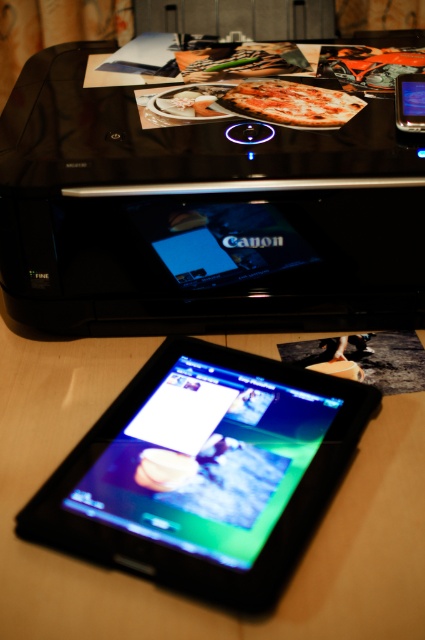
Is black glossy printer at upper center further to the viewer compared to slate gray plastic ipod at upper right?

No, it is not.

Can you confirm if black glossy printer at upper center is positioned above slate gray plastic ipod at upper right?

No, black glossy printer at upper center is not above slate gray plastic ipod at upper right.

Is point (229, 195) closer to camera compared to point (408, 106)?

Yes, it is.

Locate an element on the screen. This screenshot has height=640, width=425. black glossy printer at upper center is located at coordinates (200, 212).

Which is in front, point (125, 228) or point (295, 493)?

Point (295, 493)

Is black glossy printer at upper center bigger than black glossy tablet at center?

Yes.

The height and width of the screenshot is (640, 425). I want to click on black glossy printer at upper center, so click(200, 212).

Identify the location of black glossy printer at upper center. [200, 212].

Who is positioned more to the right, black glossy tablet at center or slate gray plastic ipod at upper right?

slate gray plastic ipod at upper right is more to the right.

Can you confirm if black glossy tablet at center is positioned below slate gray plastic ipod at upper right?

Indeed, black glossy tablet at center is positioned under slate gray plastic ipod at upper right.

Between point (85, 442) and point (399, 92), which one is positioned in front?

Positioned in front is point (85, 442).

The height and width of the screenshot is (640, 425). Find the location of `black glossy tablet at center`. black glossy tablet at center is located at coordinates (204, 472).